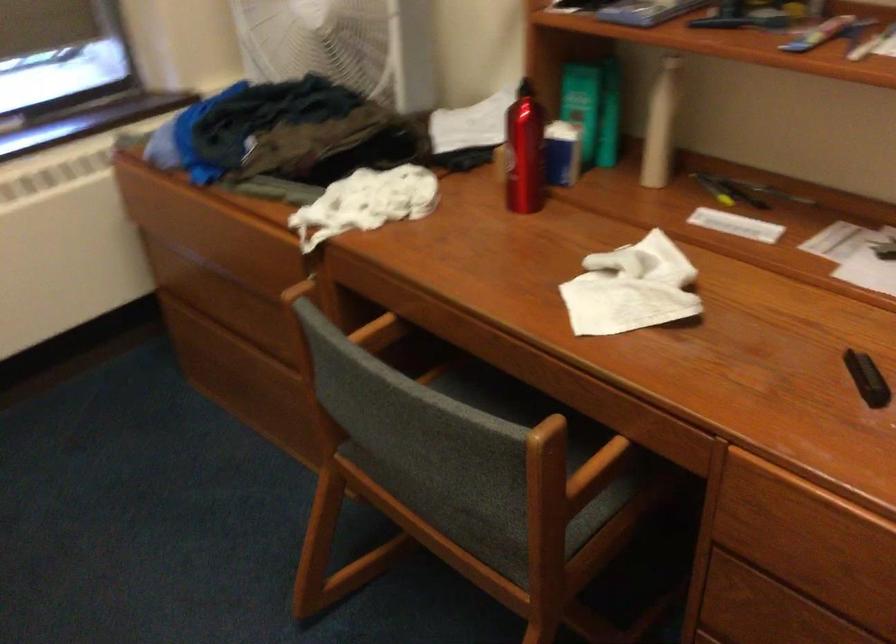
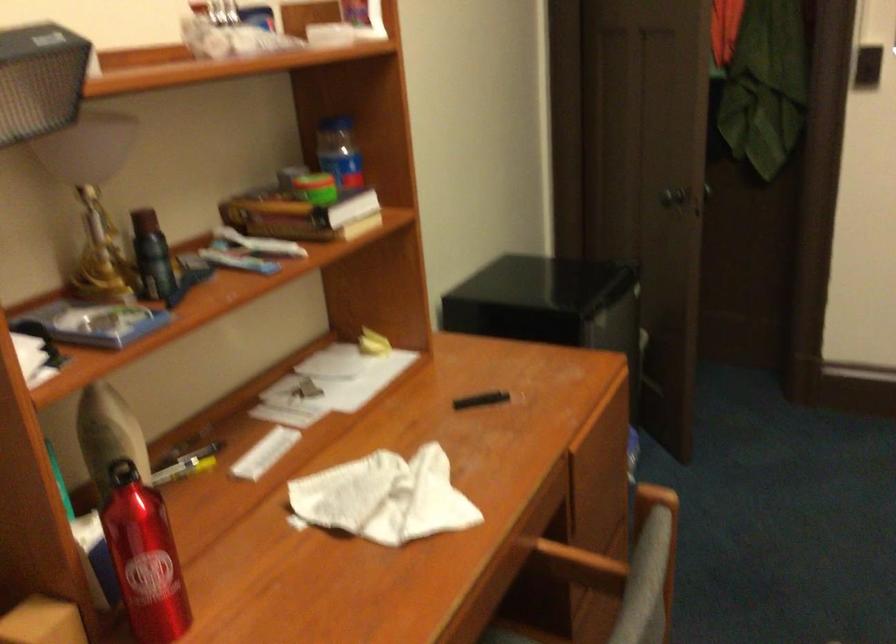
Find the pixel in the second image that matches pixel 610 266 in the first image.

(383, 498)